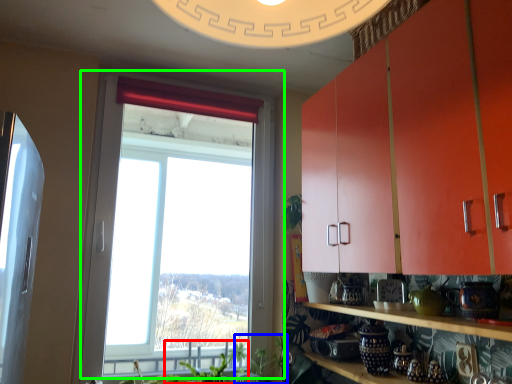
Question: Which object is positioned closest to plant (highlighted by a red box)? Select from plant (highlighted by a blue box) and window (highlighted by a green box).

Choices:
 (A) plant
 (B) window

Answer: (A)